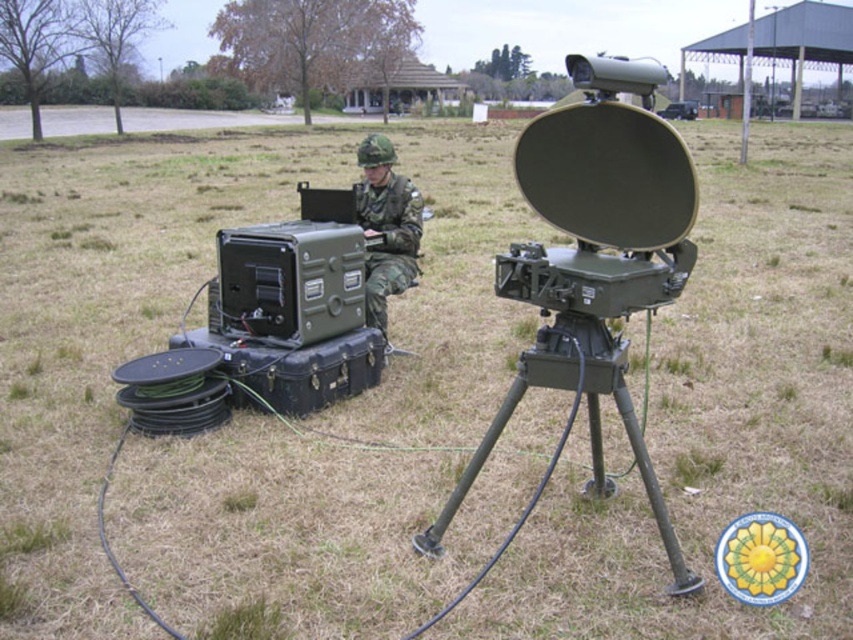
Measure the distance between green matte tripod at center and camouflage fabric uniform at center.

7.03 feet

This screenshot has width=853, height=640. What do you see at coordinates (589, 422) in the screenshot?
I see `green matte tripod at center` at bounding box center [589, 422].

Describe the element at coordinates (589, 422) in the screenshot. I see `green matte tripod at center` at that location.

Where is `green matte tripod at center`? green matte tripod at center is located at coordinates (589, 422).